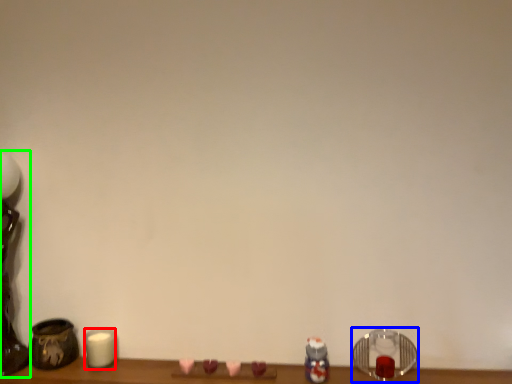
Question: Estimate the real-world distances between objects in this image. Which object is farther from candle (highlighted by a red box), candle holder (highlighted by a blue box) or table lamp (highlighted by a green box)?

Choices:
 (A) candle holder
 (B) table lamp

Answer: (A)